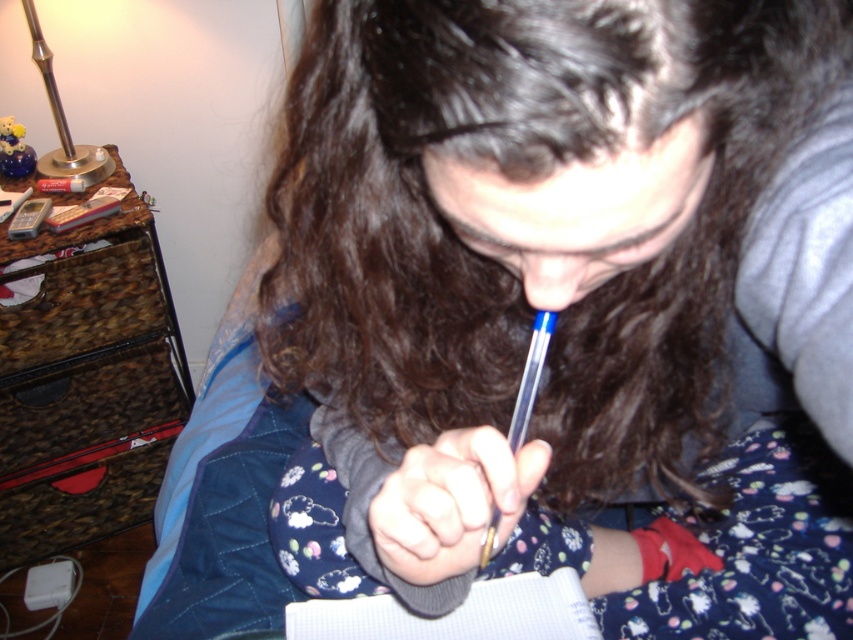
You are organizing a small desk and need to place both the brown marble dresser at left and the white paper notebook at center on it. Which object should you place first to ensure they both fit?

The brown marble dresser at left is wider than the white paper notebook at center, so you should place the brown marble dresser at left first to accommodate its larger size before placing the white paper notebook at center.

You are trying to place a small plant pot that is 0.1 meters in diameter on the brown marble drawer at left. Is there enough space for it?

The brown marble drawer at left has a position at point (83,307), but without knowing the dimensions of the drawer itself, we cannot determine if there is enough space for the plant pot. More information about the drawer size is needed.